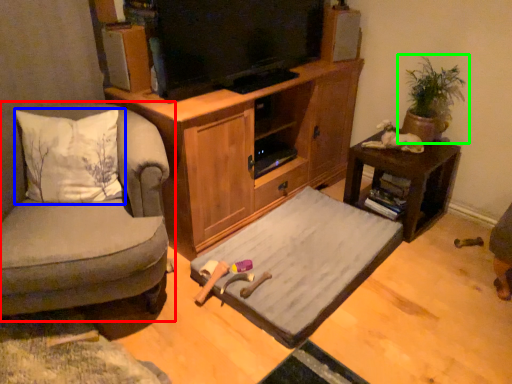
Question: Based on their relative distances, which object is nearer to chair (highlighted by a red box)? Choose from pillow (highlighted by a blue box) and houseplant (highlighted by a green box).

Choices:
 (A) pillow
 (B) houseplant

Answer: (A)